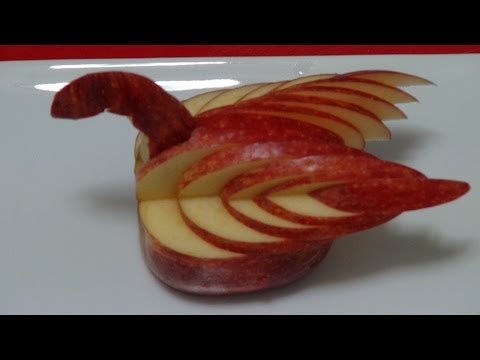
Where is `plate`? The width and height of the screenshot is (480, 360). plate is located at coordinates (423, 279).